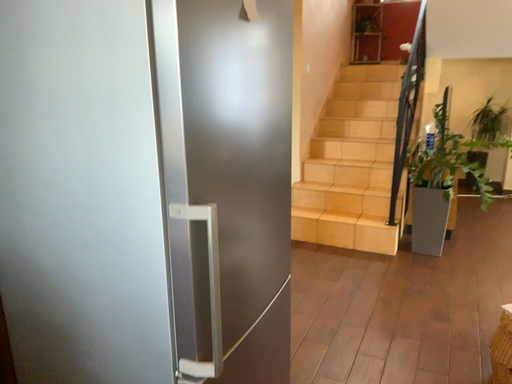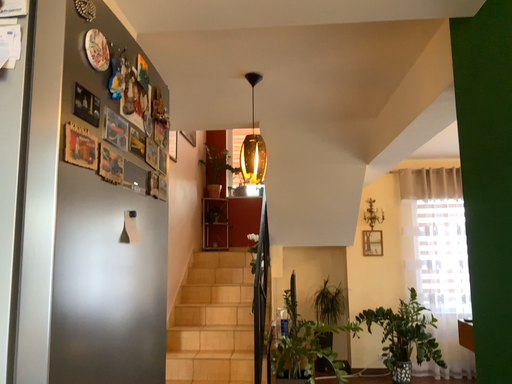
Question: Which way did the camera rotate in the video?

Choices:
 (A) rotated right
 (B) rotated left

Answer: (A)